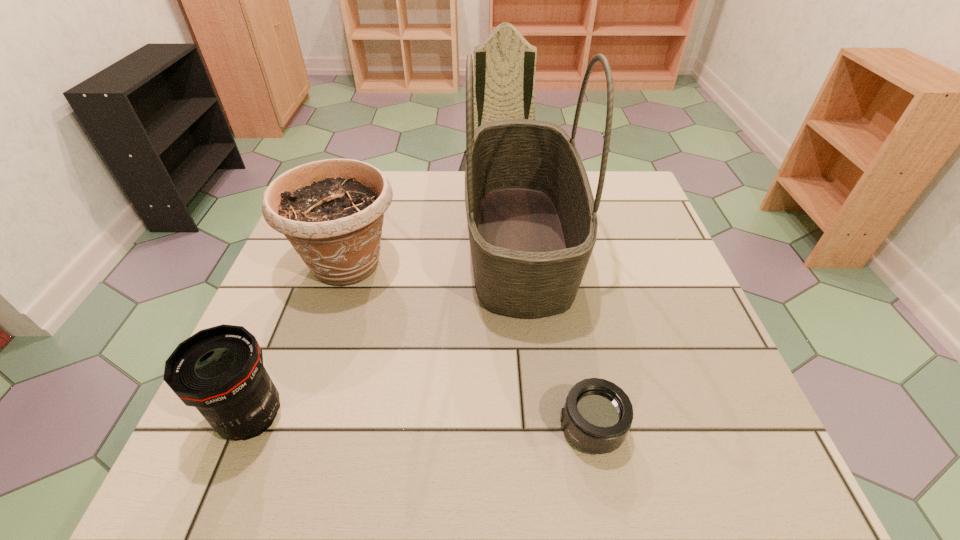
Locate an element on the screen. unoccupied area between the shortest object and the basket is located at coordinates (556, 335).

Find the location of a particular element. The height and width of the screenshot is (540, 960). the third closest object relative to the right telephoto lens is located at coordinates (219, 370).

I want to click on object that is the third nearest to the left telephoto lens, so click(x=597, y=415).

Locate an element on the screen. vacant space that satisfies the following two spatial constraints: 1. on the back side of the taller telephoto lens; 2. on the right side of the tallest object is located at coordinates (322, 242).

Image resolution: width=960 pixels, height=540 pixels. I want to click on free spot that satisfies the following two spatial constraints: 1. on the back side of the taller telephoto lens; 2. on the left side of the tallest object, so click(x=322, y=242).